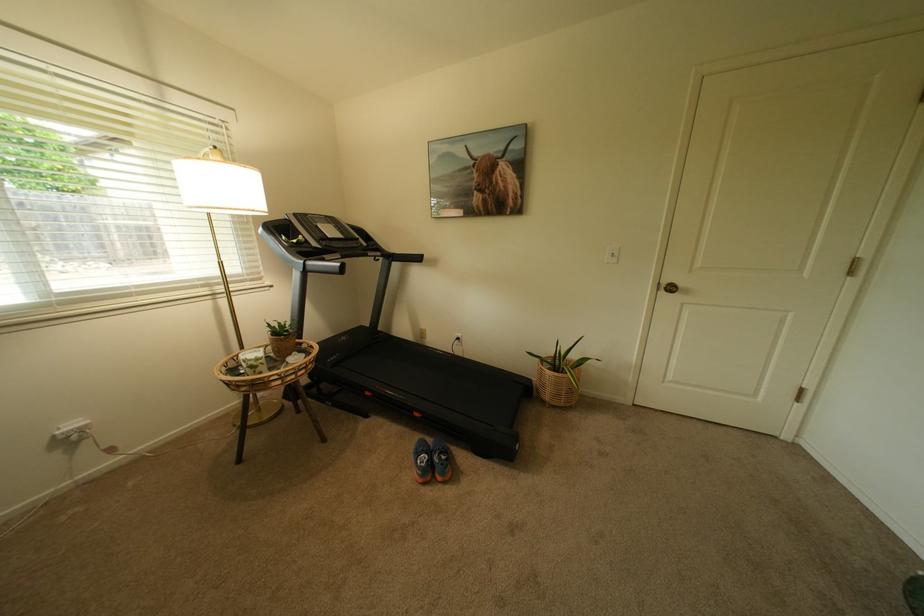
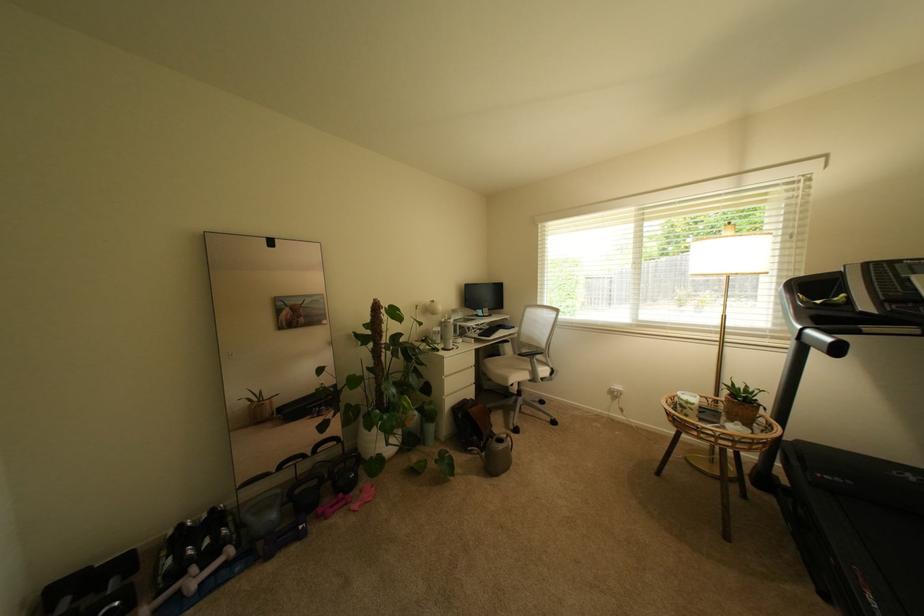
In the second image, find the point that corresponds to point (67, 434) in the first image.

(622, 389)